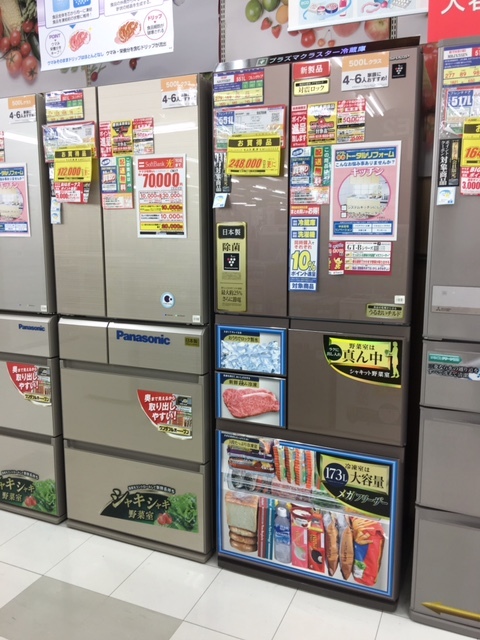
The width and height of the screenshot is (480, 640). I want to click on wall, so click(x=186, y=38).